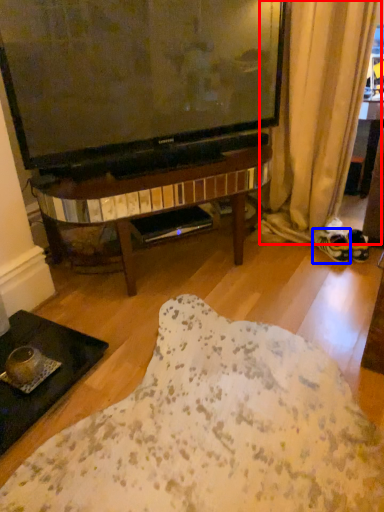
Question: Which point is further to the camera, curtain (highlighted by a red box) or footwear (highlighted by a blue box)?

Choices:
 (A) curtain
 (B) footwear

Answer: (B)